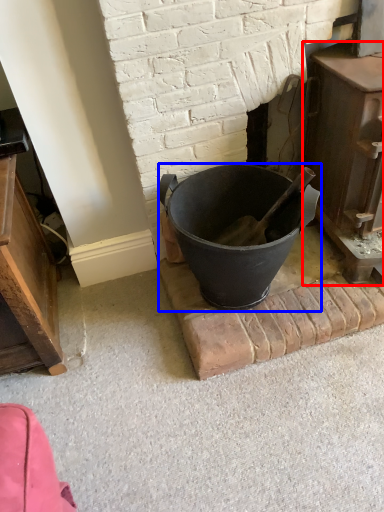
Question: Which point is further to the camera, fireplace (highlighted by a red box) or bucket (highlighted by a blue box)?

Choices:
 (A) fireplace
 (B) bucket

Answer: (B)